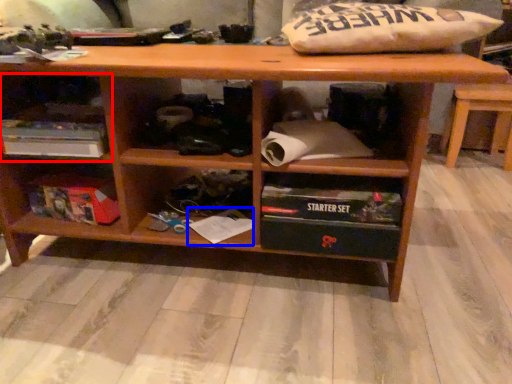
Question: Which object appears closest to the camera in this image, shelf (highlighted by a red box) or book (highlighted by a blue box)?

Choices:
 (A) shelf
 (B) book

Answer: (A)